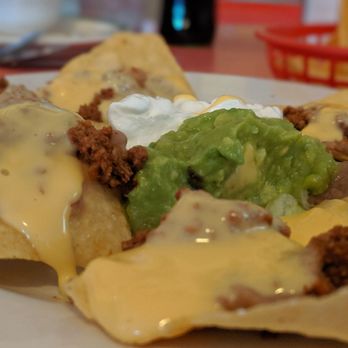
This screenshot has height=348, width=348. Identify the location of tabletop. (222, 61).